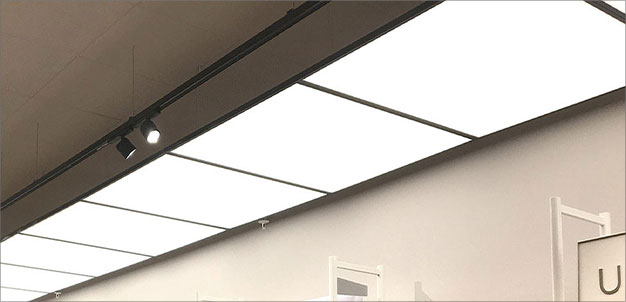
The height and width of the screenshot is (302, 626). I want to click on beam, so click(213, 66).